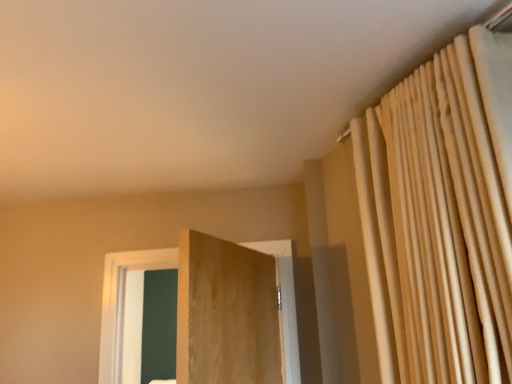
The width and height of the screenshot is (512, 384). Identify the location of beige textured curtain at upper right. (441, 216).

The width and height of the screenshot is (512, 384). What do you see at coordinates (441, 216) in the screenshot?
I see `beige textured curtain at upper right` at bounding box center [441, 216].

What is the approximate height of beige textured curtain at upper right?

The height of beige textured curtain at upper right is 34.23 inches.

Consider the image. Measure the distance between beige textured curtain at upper right and camera.

beige textured curtain at upper right and camera are 34.11 inches apart.

Locate an element on the screen. The image size is (512, 384). beige textured curtain at upper right is located at coordinates (441, 216).